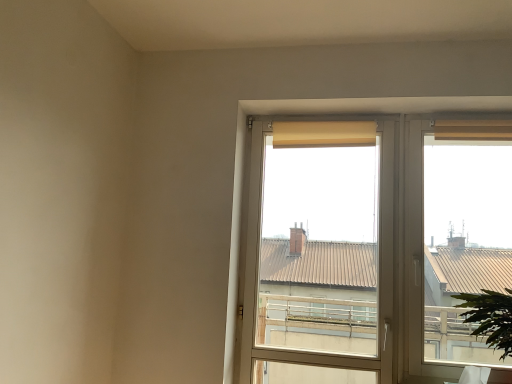
Measure the distance between beige fabric curtain at upper right, the first curtain positioned from the right, and camera.

beige fabric curtain at upper right, the first curtain positioned from the right, is 7.52 feet away from camera.

In order to face matte glass window at center, should I rotate leftwards or rightwards?

Turn right approximately 8.260 degrees to face it.

Identify the location of beige fabric curtain at upper center, the second curtain positioned from the right. The image size is (512, 384). (323, 134).

From the image's perspective, which is below, beige fabric curtain at upper right, the first curtain positioned from the right, or green leafy plant at lower right?

green leafy plant at lower right, from the image's perspective.

Find the location of a particular element. houseplant in front of the beige fabric curtain at upper right, the first curtain positioned from the right is located at coordinates (490, 317).

Considering the sizes of objects beige fabric curtain at upper right, the first curtain positioned from the right, and green leafy plant at lower right in the image provided, who is thinner, beige fabric curtain at upper right, the first curtain positioned from the right, or green leafy plant at lower right?

Thinner between the two is beige fabric curtain at upper right, the first curtain positioned from the right.

Does green leafy plant at lower right have a greater height compared to matte glass window at center?

Incorrect, the height of green leafy plant at lower right is not larger of that of matte glass window at center.

Is green leafy plant at lower right beside matte glass window at center?

green leafy plant at lower right is not next to matte glass window at center, and they're not touching.

Considering the relative positions of green leafy plant at lower right and matte glass window at center in the image provided, is green leafy plant at lower right in front of matte glass window at center?

Yes, green leafy plant at lower right is closer to the camera.

Would you say green leafy plant at lower right is inside or outside matte glass window at center?

green leafy plant at lower right exists outside the volume of matte glass window at center.

Is beige fabric curtain at upper center, the second curtain positioned from the right, in contact with beige fabric curtain at upper right, acting as the 2th curtain starting from the left?

No, beige fabric curtain at upper center, the second curtain positioned from the right, is not beside beige fabric curtain at upper right, acting as the 2th curtain starting from the left.

Measure the distance from beige fabric curtain at upper center, the first curtain from the left, to beige fabric curtain at upper right, the first curtain positioned from the right.

beige fabric curtain at upper center, the first curtain from the left, and beige fabric curtain at upper right, the first curtain positioned from the right, are 23.00 inches apart from each other.

Considering the relative sizes of beige fabric curtain at upper center, the first curtain from the left, and beige fabric curtain at upper right, the first curtain positioned from the right, in the image provided, is beige fabric curtain at upper center, the first curtain from the left, wider than beige fabric curtain at upper right, the first curtain positioned from the right,?

In fact, beige fabric curtain at upper center, the first curtain from the left, might be narrower than beige fabric curtain at upper right, the first curtain positioned from the right.

From a real-world perspective, is beige fabric curtain at upper center, the first curtain from the left, positioned over beige fabric curtain at upper right, acting as the 2th curtain starting from the left, based on gravity?

No, from a real-world perspective, beige fabric curtain at upper center, the first curtain from the left, is not over beige fabric curtain at upper right, acting as the 2th curtain starting from the left

Based on the photo, which is more to the right, matte glass window at center or beige fabric curtain at upper right, the first curtain positioned from the right?

beige fabric curtain at upper right, the first curtain positioned from the right.

Considering the relative sizes of matte glass window at center and beige fabric curtain at upper right, acting as the 2th curtain starting from the left, in the image provided, is matte glass window at center bigger than beige fabric curtain at upper right, acting as the 2th curtain starting from the left,?

Yes, matte glass window at center is bigger than beige fabric curtain at upper right, acting as the 2th curtain starting from the left.

Does matte glass window at center have a greater width compared to beige fabric curtain at upper right, acting as the 2th curtain starting from the left?

Yes, matte glass window at center is wider than beige fabric curtain at upper right, acting as the 2th curtain starting from the left.

How different are the orientations of matte glass window at center and beige fabric curtain at upper right, the first curtain positioned from the right, in degrees?

The angle between the facing direction of matte glass window at center and the facing direction of beige fabric curtain at upper right, the first curtain positioned from the right, is 4.95e-05 degrees.

Is point (323, 123) positioned behind point (466, 305)?

Yes, point (323, 123) is behind point (466, 305).

Consider the image. From the image's perspective, is beige fabric curtain at upper center, the first curtain from the left, above or below green leafy plant at lower right?

beige fabric curtain at upper center, the first curtain from the left, is situated higher than green leafy plant at lower right in the image.

Based on the photo, how many degrees apart are the facing directions of beige fabric curtain at upper center, the second curtain positioned from the right, and green leafy plant at lower right?

There is a 0.000883-degree angle between the facing directions of beige fabric curtain at upper center, the second curtain positioned from the right, and green leafy plant at lower right.

From a real-world perspective, which is physically above, beige fabric curtain at upper center, the second curtain positioned from the right, or green leafy plant at lower right?

beige fabric curtain at upper center, the second curtain positioned from the right, is physically above.

Would you say green leafy plant at lower right is part of matte glass window at center's contents?

That's incorrect, green leafy plant at lower right is not inside matte glass window at center.

Is matte glass window at center turned away from green leafy plant at lower right?

matte glass window at center does not have its back to green leafy plant at lower right.

Considering the relative positions of matte glass window at center and green leafy plant at lower right in the image provided, is matte glass window at center to the right of green leafy plant at lower right from the viewer's perspective?

No.

Considering the points (470, 280) and (479, 332), which point is in front, point (470, 280) or point (479, 332)?

The point (479, 332) is more forward.

From the image's perspective, between green leafy plant at lower right and beige fabric curtain at upper right, the first curtain positioned from the right, who is located below?

green leafy plant at lower right appears lower in the image.

Is green leafy plant at lower right positioned with its back to beige fabric curtain at upper right, the first curtain positioned from the right?

green leafy plant at lower right does not have its back to beige fabric curtain at upper right, the first curtain positioned from the right.

Which is in front, point (490, 302) or point (446, 127)?

The point (490, 302) is in front.

Find the location of a particular element. houseplant below the beige fabric curtain at upper right, acting as the 2th curtain starting from the left (from the image's perspective) is located at coordinates (490, 317).

Identify the location of the 2nd curtain positioned above the green leafy plant at lower right (from the image's perspective). This screenshot has height=384, width=512. (473, 130).

The width and height of the screenshot is (512, 384). In order to click on window on the left of green leafy plant at lower right in this screenshot , I will do `click(356, 262)`.

Based on their spatial positions, is beige fabric curtain at upper center, the second curtain positioned from the right, or green leafy plant at lower right further from matte glass window at center?

green leafy plant at lower right is positioned further to the anchor matte glass window at center.

Which object lies nearer to the anchor point beige fabric curtain at upper center, the second curtain positioned from the right, matte glass window at center or beige fabric curtain at upper right, the first curtain positioned from the right?

matte glass window at center is closer to beige fabric curtain at upper center, the second curtain positioned from the right.

Considering their positions, is matte glass window at center positioned further to beige fabric curtain at upper right, acting as the 2th curtain starting from the left, than green leafy plant at lower right?

green leafy plant at lower right.

From the image, which object appears to be farther from beige fabric curtain at upper right, the first curtain positioned from the right, green leafy plant at lower right or beige fabric curtain at upper center, the first curtain from the left?

green leafy plant at lower right is further to beige fabric curtain at upper right, the first curtain positioned from the right.

Estimate the real-world distances between objects in this image. Which object is further from green leafy plant at lower right, beige fabric curtain at upper right, the first curtain positioned from the right, or matte glass window at center?

Based on the image, beige fabric curtain at upper right, the first curtain positioned from the right, appears to be further to green leafy plant at lower right.

Estimate the real-world distances between objects in this image. Which object is further from matte glass window at center, green leafy plant at lower right or beige fabric curtain at upper center, the first curtain from the left?

green leafy plant at lower right lies further to matte glass window at center than the other object.

Looking at this image, based on their spatial positions, is beige fabric curtain at upper center, the second curtain positioned from the right, or green leafy plant at lower right closer to beige fabric curtain at upper right, the first curtain positioned from the right?

Based on the image, beige fabric curtain at upper center, the second curtain positioned from the right, appears to be nearer to beige fabric curtain at upper right, the first curtain positioned from the right.

From the image, which object appears to be nearer to beige fabric curtain at upper center, the first curtain from the left, beige fabric curtain at upper right, the first curtain positioned from the right, or green leafy plant at lower right?

Based on the image, beige fabric curtain at upper right, the first curtain positioned from the right, appears to be nearer to beige fabric curtain at upper center, the first curtain from the left.

Locate an element on the screen. Image resolution: width=512 pixels, height=384 pixels. curtain located between matte glass window at center and beige fabric curtain at upper right, acting as the 2th curtain starting from the left, in the left-right direction is located at coordinates (323, 134).

Image resolution: width=512 pixels, height=384 pixels. I want to click on window between beige fabric curtain at upper center, the second curtain positioned from the right, and green leafy plant at lower right from top to bottom, so [356, 262].

Image resolution: width=512 pixels, height=384 pixels. I want to click on curtain between beige fabric curtain at upper right, the first curtain positioned from the right, and green leafy plant at lower right, in the vertical direction, so click(323, 134).

The width and height of the screenshot is (512, 384). I want to click on window that lies between beige fabric curtain at upper right, the first curtain positioned from the right, and green leafy plant at lower right from top to bottom, so click(x=356, y=262).